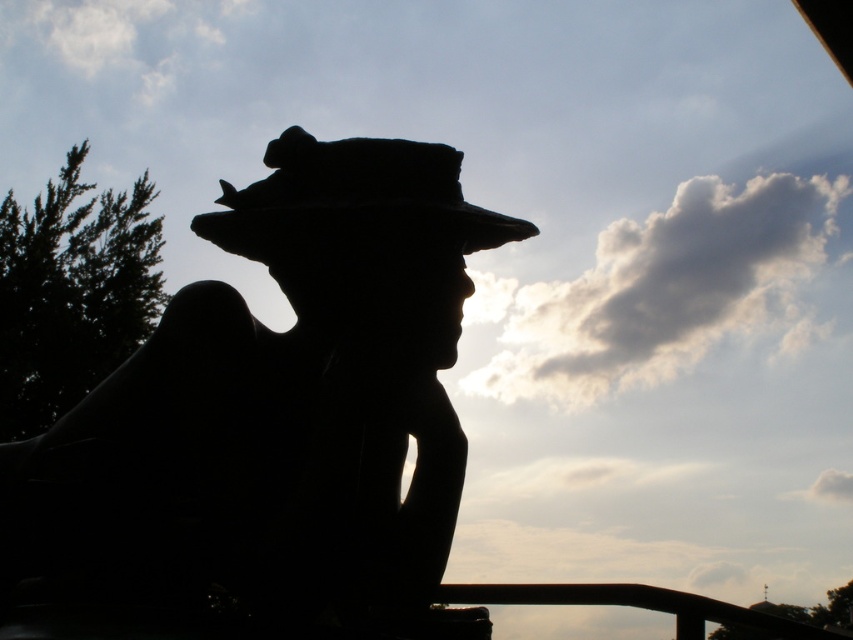
Question: Is black matte statue at center further to the viewer compared to silvery metallic fedora at center?

Choices:
 (A) yes
 (B) no

Answer: (B)

Question: Is black matte statue at center smaller than silvery metallic fedora at center?

Choices:
 (A) yes
 (B) no

Answer: (B)

Question: Which of the following is the farthest from the observer?

Choices:
 (A) black matte statue at center
 (B) silvery metallic fedora at center

Answer: (B)

Question: Which object appears farthest from the camera in this image?

Choices:
 (A) black matte statue at center
 (B) silvery metallic fedora at center

Answer: (B)

Question: Is black matte statue at center to the right of silvery metallic fedora at center from the viewer's perspective?

Choices:
 (A) no
 (B) yes

Answer: (A)